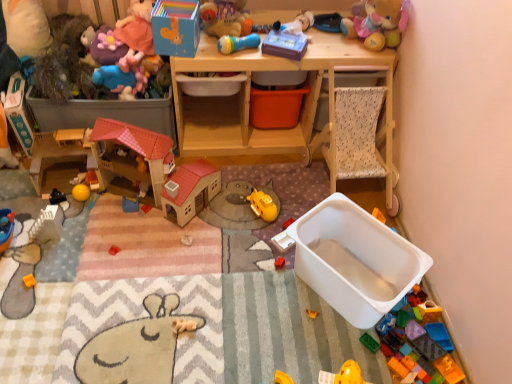
Find the location of a particular element. The image size is (512, 384). free space in front of yellow matte submarine at center, which appears as the fourth toy when viewed from the right is located at coordinates click(253, 242).